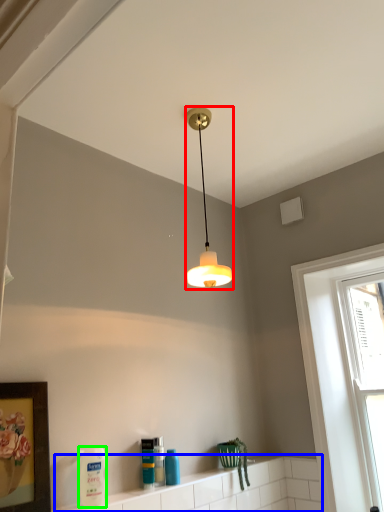
Question: Which object is the farthest from lamp (highlighted by a red box)? Choose among these: window sill (highlighted by a blue box) or cleaning product (highlighted by a green box).

Choices:
 (A) window sill
 (B) cleaning product

Answer: (A)